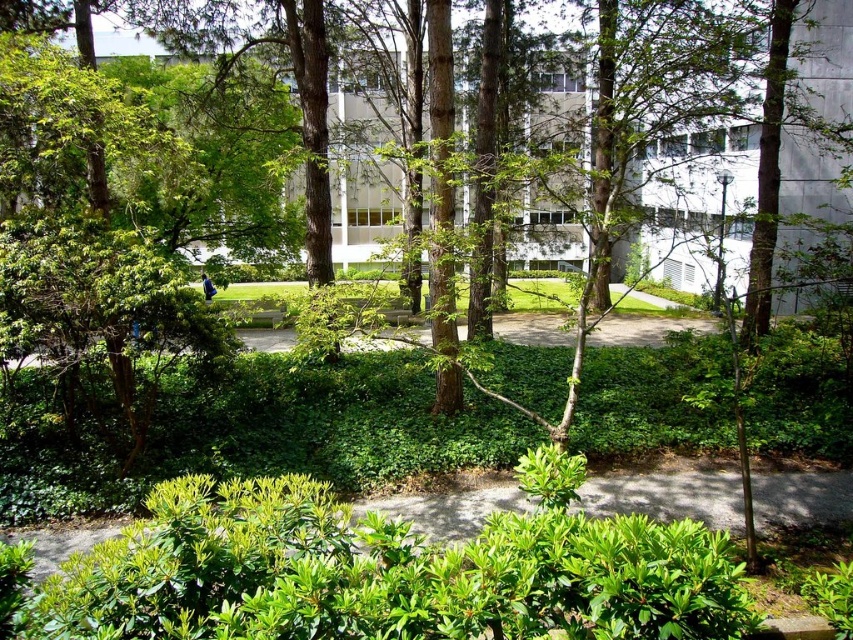
Question: Can you confirm if green leafy bush at center is thinner than green leafy tree at center?

Choices:
 (A) yes
 (B) no

Answer: (A)

Question: Which object is closer to the camera taking this photo?

Choices:
 (A) green leafy tree at center
 (B) green leafy bush at center

Answer: (B)

Question: Does green leafy bush at center appear on the left side of green leafy tree at center?

Choices:
 (A) no
 (B) yes

Answer: (B)

Question: Can you confirm if green leafy bush at center is positioned below green leafy tree at center?

Choices:
 (A) no
 (B) yes

Answer: (B)